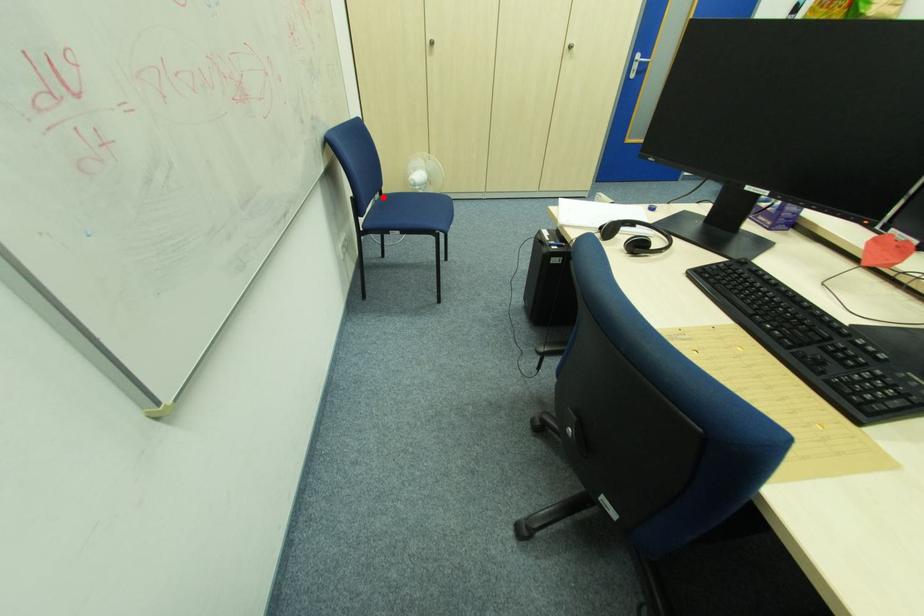
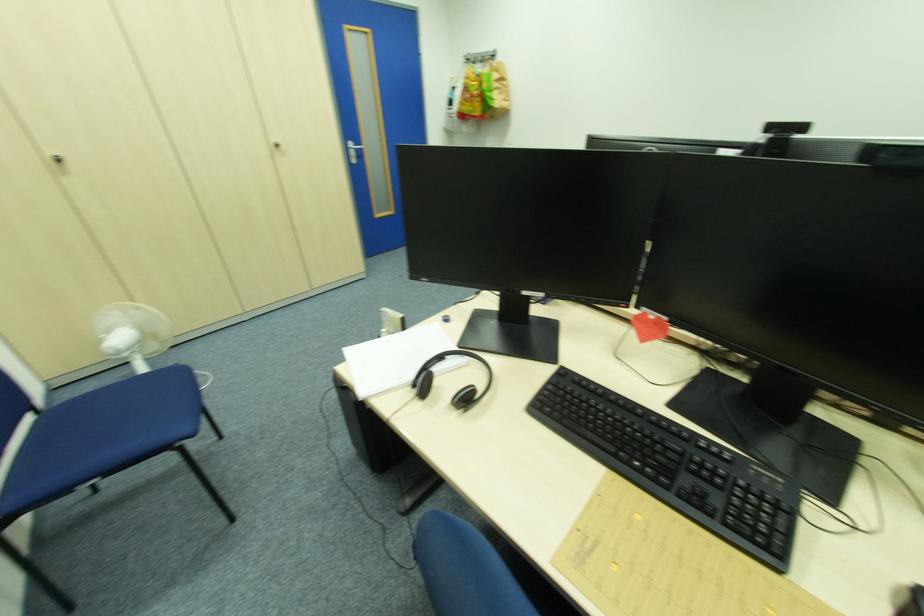
Question: A red point is marked in image1. In image2, is the corresponding 3D point closer to the camera or farther? Reply with the corresponding letter.

Choices:
 (A) The corresponding 3D point is closer.
 (B) The corresponding 3D point is farther.

Answer: (B)